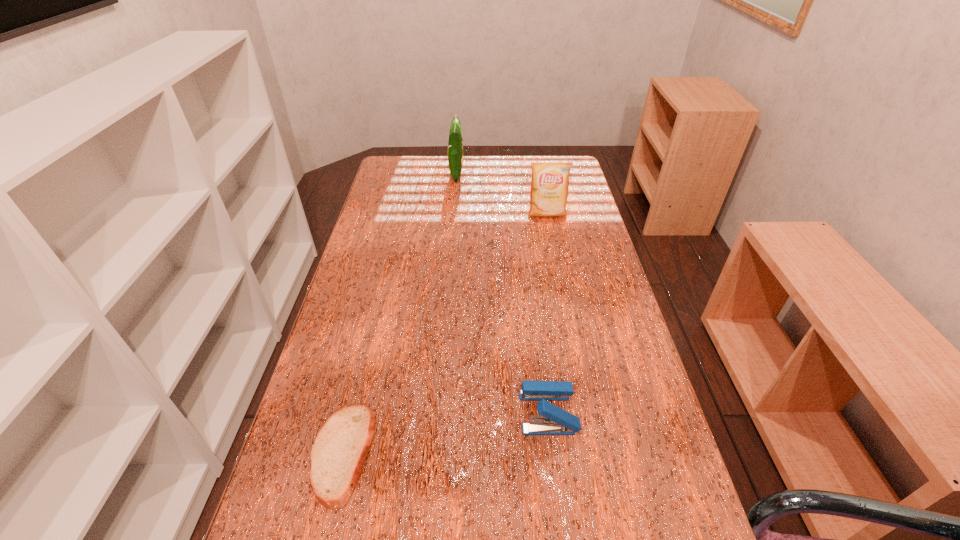
The height and width of the screenshot is (540, 960). Find the location of `the third object from right to left`. the third object from right to left is located at coordinates (455, 144).

Locate an element on the screen. The image size is (960, 540). the farther crisp (potato chip) is located at coordinates (455, 144).

Locate an element on the screen. The image size is (960, 540). the right crisp (potato chip) is located at coordinates (550, 180).

Locate an element on the screen. the second farthest object is located at coordinates (550, 180).

Locate an element on the screen. The width and height of the screenshot is (960, 540). the third tallest object is located at coordinates (555, 421).

Where is `the shortest object`? The height and width of the screenshot is (540, 960). the shortest object is located at coordinates (339, 451).

The height and width of the screenshot is (540, 960). Identify the location of the leftmost object. (339, 451).

Find the location of a particular element. vacant space located on the front-facing side of the farthest object is located at coordinates (487, 174).

Identify the location of vacant space located on the front-facing side of the right crisp (potato chip). Image resolution: width=960 pixels, height=540 pixels. (563, 291).

This screenshot has width=960, height=540. Identify the location of vacant area situated on the front of the stapler. (556, 475).